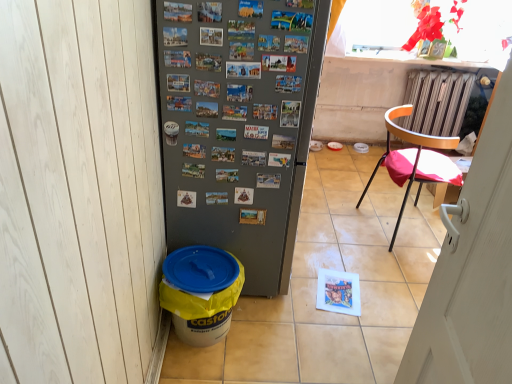
Question: From the image's perspective, is yellow plastic bucket at lower left beneath orange plastic chair at right?

Choices:
 (A) yes
 (B) no

Answer: (A)

Question: From a real-world perspective, is yellow plastic bucket at lower left positioned under orange plastic chair at right based on gravity?

Choices:
 (A) no
 (B) yes

Answer: (B)

Question: Considering the relative sizes of yellow plastic bucket at lower left and orange plastic chair at right in the image provided, is yellow plastic bucket at lower left smaller than orange plastic chair at right?

Choices:
 (A) yes
 (B) no

Answer: (A)

Question: Is yellow plastic bucket at lower left with orange plastic chair at right?

Choices:
 (A) no
 (B) yes

Answer: (A)

Question: Is yellow plastic bucket at lower left further to the viewer compared to orange plastic chair at right?

Choices:
 (A) yes
 (B) no

Answer: (B)

Question: Based on their sizes in the image, would you say orange plastic chair at right is bigger or smaller than yellow plastic bucket at lower left?

Choices:
 (A) small
 (B) big

Answer: (B)

Question: From a real-world perspective, relative to yellow plastic bucket at lower left, is orange plastic chair at right vertically above or below?

Choices:
 (A) above
 (B) below

Answer: (A)

Question: Considering the positions of orange plastic chair at right and yellow plastic bucket at lower left in the image, is orange plastic chair at right wider or thinner than yellow plastic bucket at lower left?

Choices:
 (A) wide
 (B) thin

Answer: (B)

Question: Based on their positions, is orange plastic chair at right located to the left or right of yellow plastic bucket at lower left?

Choices:
 (A) right
 (B) left

Answer: (A)

Question: Is yellow plastic bucket at lower left taller or shorter than orange plastic chair at right?

Choices:
 (A) tall
 (B) short

Answer: (B)

Question: From a real-world perspective, relative to orange plastic chair at right, is yellow plastic bucket at lower left vertically above or below?

Choices:
 (A) above
 (B) below

Answer: (B)

Question: Looking at the image, does yellow plastic bucket at lower left seem bigger or smaller compared to orange plastic chair at right?

Choices:
 (A) small
 (B) big

Answer: (A)

Question: In the image, is yellow plastic bucket at lower left positioned in front of or behind orange plastic chair at right?

Choices:
 (A) front
 (B) behind

Answer: (A)

Question: In terms of height, does wooden chair with red cushion at right look taller or shorter compared to orange plastic chair at right?

Choices:
 (A) short
 (B) tall

Answer: (B)

Question: Is point (420, 155) closer or farther from the camera than point (411, 114)?

Choices:
 (A) closer
 (B) farther

Answer: (A)